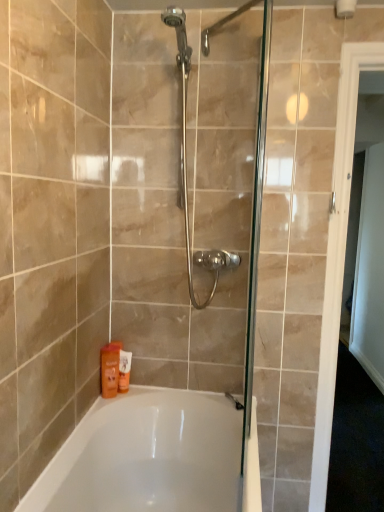
Question: Does white glossy door at right touch orange matte bottle at lower left, which is counted as the first toiletry, starting from the front?

Choices:
 (A) no
 (B) yes

Answer: (A)

Question: From the image's perspective, is white glossy door at right above orange matte bottle at lower left, which is counted as the first toiletry, starting from the front?

Choices:
 (A) no
 (B) yes

Answer: (B)

Question: From a real-world perspective, is white glossy door at right on top of orange matte bottle at lower left, which is counted as the first toiletry, starting from the front?

Choices:
 (A) yes
 (B) no

Answer: (A)

Question: Is white glossy door at right at the left side of orange matte bottle at lower left, which is counted as the first toiletry, starting from the front?

Choices:
 (A) no
 (B) yes

Answer: (A)

Question: Can you confirm if white glossy door at right is taller than orange matte bottle at lower left, which ranks as the second toiletry in back-to-front order?

Choices:
 (A) no
 (B) yes

Answer: (B)

Question: Looking at their shapes, would you say orange matte bottle at lower left, which is counted as the first toiletry, starting from the front, is wider or thinner than white glossy bathtub at lower center?

Choices:
 (A) thin
 (B) wide

Answer: (A)

Question: From a real-world perspective, is orange matte bottle at lower left, which ranks as the second toiletry in back-to-front order, above or below white glossy bathtub at lower center?

Choices:
 (A) above
 (B) below

Answer: (A)

Question: Does point (105, 389) appear closer or farther from the camera than point (139, 488)?

Choices:
 (A) farther
 (B) closer

Answer: (A)

Question: Considering the relative positions of orange matte bottle at lower left, which is counted as the first toiletry, starting from the front, and white glossy bathtub at lower center in the image provided, is orange matte bottle at lower left, which is counted as the first toiletry, starting from the front, to the left or to the right of white glossy bathtub at lower center?

Choices:
 (A) left
 (B) right

Answer: (A)

Question: From a real-world perspective, is white glossy bathtub at lower center physically located above or below orange matte lotion at lower left, the first toiletry viewed from the back?

Choices:
 (A) above
 (B) below

Answer: (B)

Question: Is white glossy bathtub at lower center bigger or smaller than orange matte lotion at lower left, arranged as the 2th toiletry when viewed from the front?

Choices:
 (A) small
 (B) big

Answer: (B)

Question: From the image's perspective, is white glossy bathtub at lower center above or below orange matte lotion at lower left, the first toiletry viewed from the back?

Choices:
 (A) below
 (B) above

Answer: (A)

Question: Looking at their shapes, would you say white glossy bathtub at lower center is wider or thinner than orange matte lotion at lower left, arranged as the 2th toiletry when viewed from the front?

Choices:
 (A) thin
 (B) wide

Answer: (B)

Question: From the image's perspective, is orange matte bottle at lower left, which ranks as the second toiletry in back-to-front order, located above or below orange matte lotion at lower left, arranged as the 2th toiletry when viewed from the front?

Choices:
 (A) above
 (B) below

Answer: (A)

Question: Based on their sizes in the image, would you say orange matte bottle at lower left, which is counted as the first toiletry, starting from the front, is bigger or smaller than orange matte lotion at lower left, arranged as the 2th toiletry when viewed from the front?

Choices:
 (A) small
 (B) big

Answer: (B)